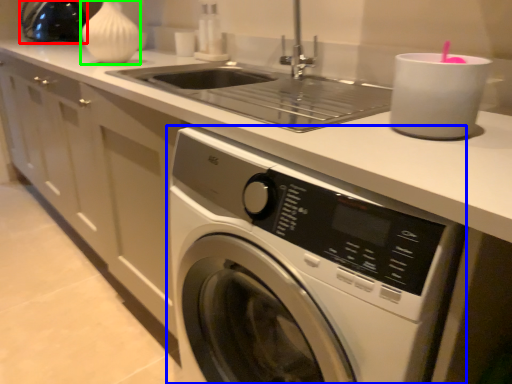
Question: Which object is positioned closest to appliance (highlighted by a red box)? Select from washing machine (highlighted by a blue box) and vase (highlighted by a green box).

Choices:
 (A) washing machine
 (B) vase

Answer: (B)